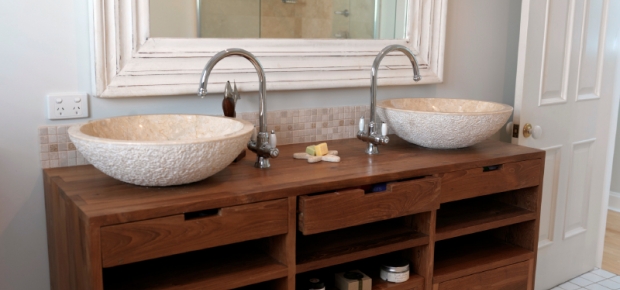
You are a GUI agent. You are given a task and a screenshot of the screen. Output one action in this format:
    pyautogui.click(x=<x>, y=<y>)
    Task: Click on the light beige tiles
    Image resolution: width=620 pixels, height=290 pixels.
    Given the screenshot: What is the action you would take?
    pyautogui.click(x=327, y=125), pyautogui.click(x=281, y=122)